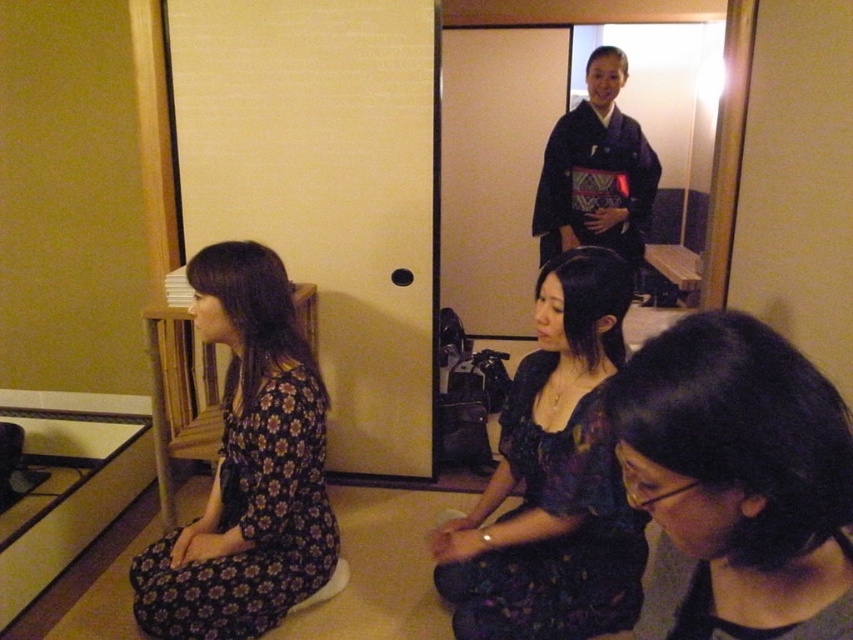
Can you confirm if dark gray matte/black hair at lower right is shorter than dark blue kimono at upper center?

Yes.

Does dark gray matte/black hair at lower right have a smaller size compared to dark blue kimono at upper center?

Yes, dark gray matte/black hair at lower right is smaller than dark blue kimono at upper center.

The image size is (853, 640). What do you see at coordinates (735, 483) in the screenshot? I see `dark gray matte/black hair at lower right` at bounding box center [735, 483].

At what (x,y) coordinates should I click in order to perform the action: click on dark gray matte/black hair at lower right. Please return your answer as a coordinate pair (x, y). This screenshot has height=640, width=853. Looking at the image, I should click on (735, 483).

Does dark gray matte/black hair at lower right appear under dark floral dress at center?

No.

Locate an element on the screen. This screenshot has height=640, width=853. dark gray matte/black hair at lower right is located at coordinates (735, 483).

Measure the distance between point (764,634) and camera.

Point (764,634) is 29.08 inches away from camera.

Where is `dark gray matte/black hair at lower right`? This screenshot has width=853, height=640. dark gray matte/black hair at lower right is located at coordinates tap(735, 483).

Is dark gray matte/black hair at lower right below floral-patterned dress at left?

Incorrect, dark gray matte/black hair at lower right is not positioned below floral-patterned dress at left.

Who is higher up, dark gray matte/black hair at lower right or floral-patterned dress at left?

dark gray matte/black hair at lower right is higher up.

Which is behind, point (762, 529) or point (273, 554)?

The point (273, 554) is behind.

You are a GUI agent. You are given a task and a screenshot of the screen. Output one action in this format:
    pyautogui.click(x=<x>, y=<y>)
    Task: Click on the dark gray matte/black hair at lower right
    
    Given the screenshot: What is the action you would take?
    pyautogui.click(x=735, y=483)